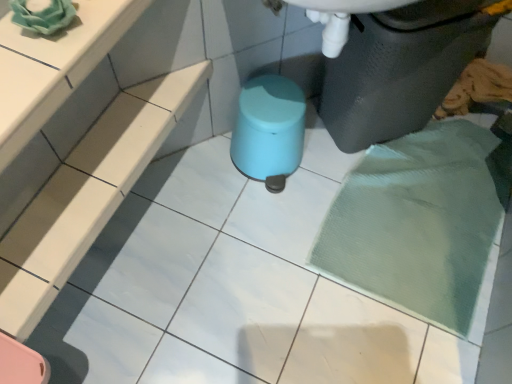
At what (x,y) coordinates should I click in order to perform the action: click on free space on the front side of matte plastic waste container at lower right. Please return your answer as a coordinate pair (x, y). The image size is (512, 384). Looking at the image, I should click on (386, 199).